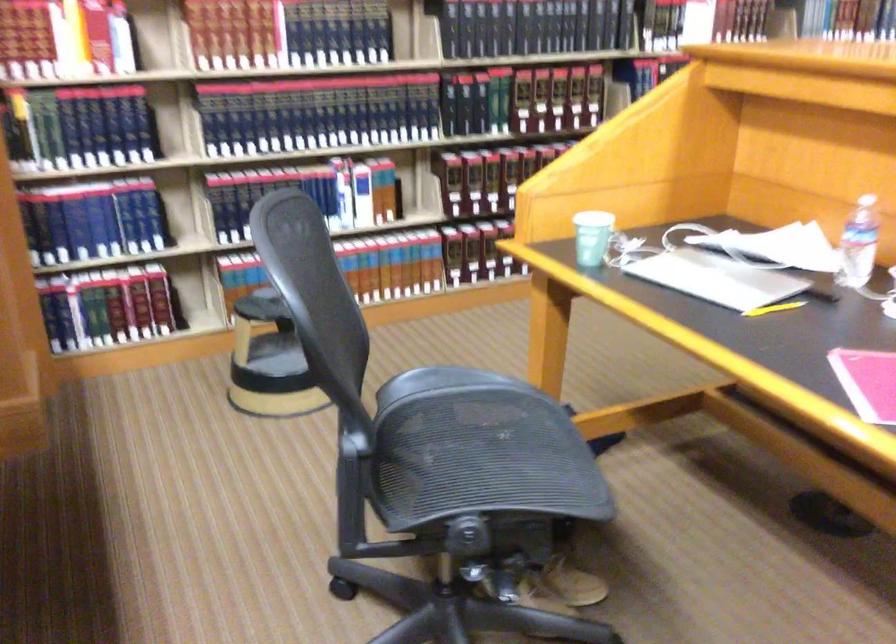
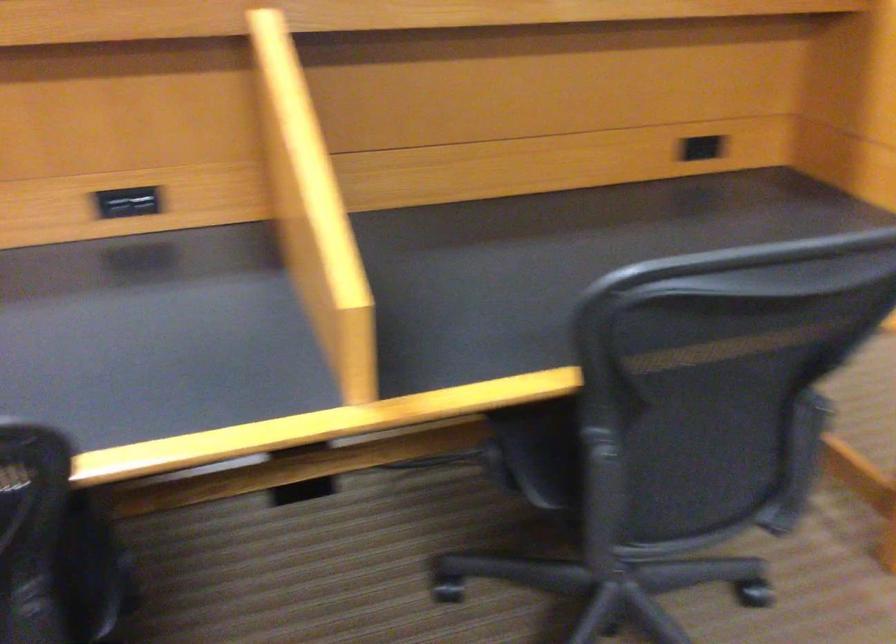
Question: I am providing you with two images of the same scene from different viewpoints. Please identify which objects are invisible in image2.

Choices:
 (A) black power outlet
 (B) small toy bus
 (C) yellow pencil
 (D) chair sitting surface

Answer: (C)